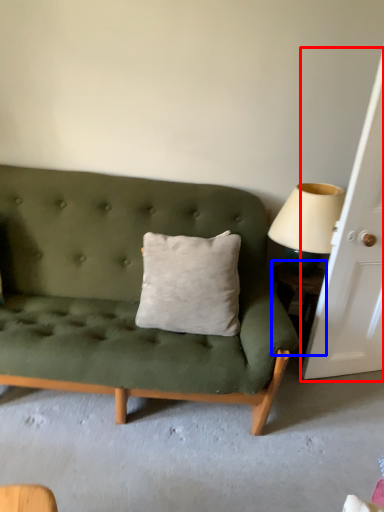
Question: Which object appears closest to the camera in this image, door (highlighted by a red box) or table (highlighted by a blue box)?

Choices:
 (A) door
 (B) table

Answer: (A)